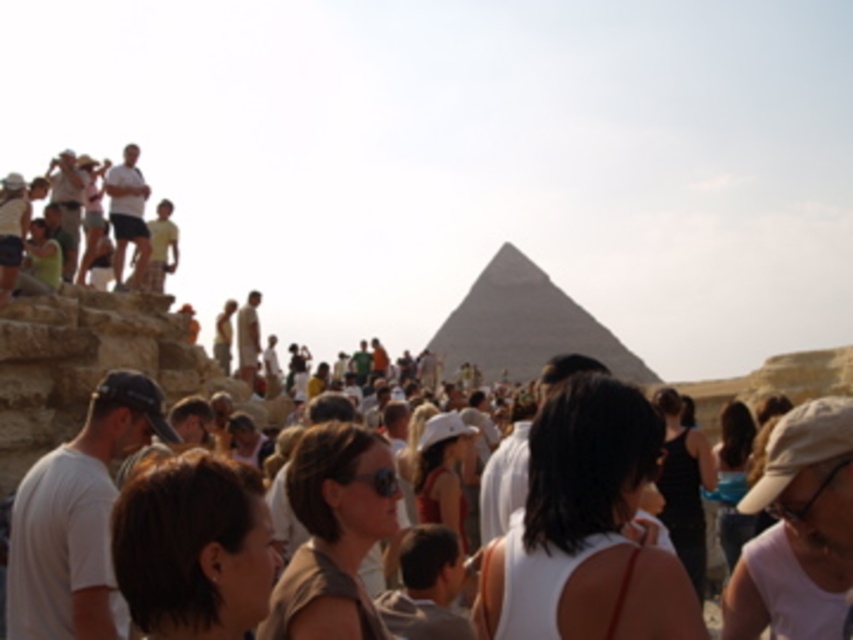
You are a photographer standing at the back of the crowd. You want to take a photo of the white cotton shirt at left without the dark brown hair at center blocking it. What should you do?

Move to the right side so that the dark brown hair at center is no longer in front of the white cotton shirt at left, allowing you to capture the shirt without obstruction.

You are a photographer at the Great Pyramid of Giza. You want to capture a photo of the white fabric dress at center and the dark brown hair at center. Which object is wider when viewed from your current position?

The white fabric dress at center is wider than the dark brown hair at center.